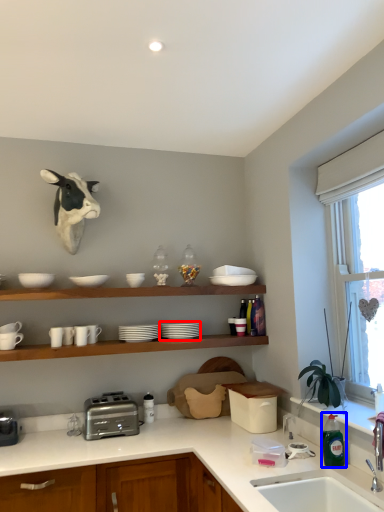
Question: Which of the following is the farthest to the observer, tableware (highlighted by a red box) or bottle (highlighted by a blue box)?

Choices:
 (A) tableware
 (B) bottle

Answer: (A)